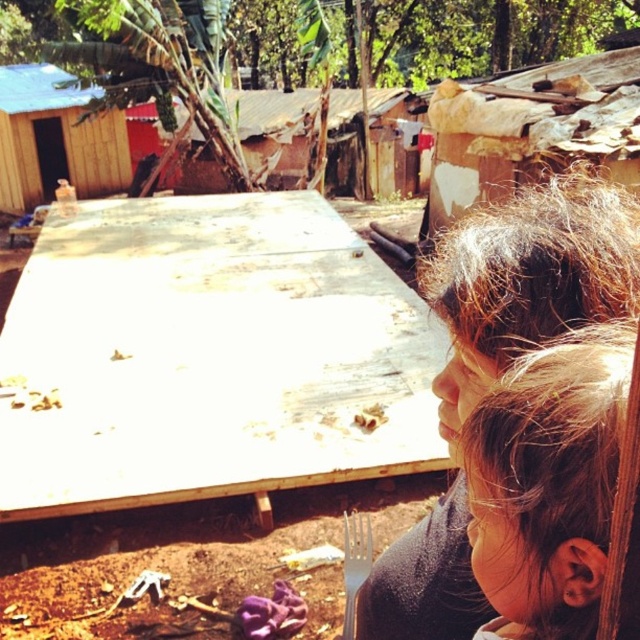
You are a photographer setting up a shot of the dark brown hair at upper right and the silver metallic fork at lower center. Which object should you focus on first if you want to capture both in the same frame without moving the camera?

You should focus on the dark brown hair at upper right first because it is taller than the silver metallic fork at lower center, so adjusting focus to the taller object ensures both are in frame.

You are standing in front of the wooden table in the scene and want to place two markers at the coordinates point [438,412] and point [307,113]. Which marker will appear closer to you when viewed from your current position?

Point [438,412] is closer to the viewer than point [307,113], so the marker at point [438,412] will appear closer to you.